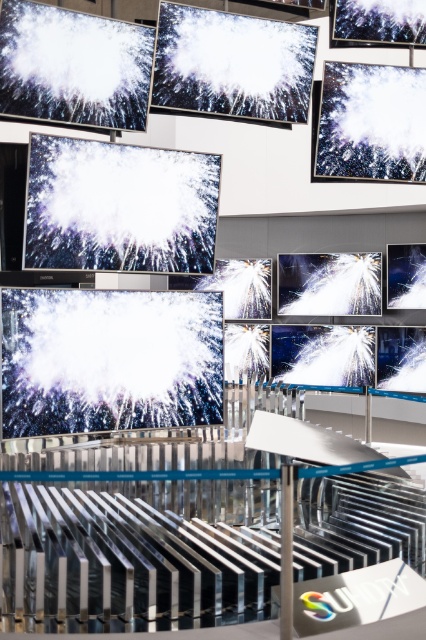
Can you confirm if white glossy screen at center is positioned to the left of white glossy water at upper right?

Yes, white glossy screen at center is to the left of white glossy water at upper right.

Does white glossy screen at center have a greater width compared to white glossy water at upper right?

Yes, white glossy screen at center is wider than white glossy water at upper right.

This screenshot has height=640, width=426. What do you see at coordinates (118, 205) in the screenshot?
I see `white glossy screen at center` at bounding box center [118, 205].

I want to click on white glossy screen at center, so click(118, 205).

The image size is (426, 640). What are the coordinates of `white glossy screen at center` in the screenshot? It's located at (118, 205).

Looking at this image, which of these two, white glossy screen at center or matte black monitor at center, stands taller?

matte black monitor at center is taller.

Is point (204, 198) behind point (402, 269)?

No, (204, 198) is in front of (402, 269).

You are a GUI agent. You are given a task and a screenshot of the screen. Output one action in this format:
    pyautogui.click(x=<x>, y=<y>)
    Task: Click on the white glossy screen at center
    This screenshot has height=640, width=426.
    Given the screenshot: What is the action you would take?
    pyautogui.click(x=118, y=205)

Looking at this image, who is lower down, white glossy monitor at upper left or white glossy water at upper right?

white glossy water at upper right is below.

Is point (8, 0) more distant than point (370, 92)?

No, it is in front of (370, 92).

In order to click on white glossy monitor at upper left in this screenshot , I will do `click(74, 67)`.